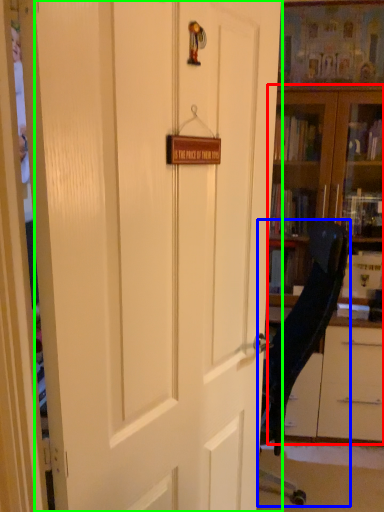
Question: Which object is the closest to the bookcase (highlighted by a red box)? Choose among these: chair (highlighted by a blue box) or door (highlighted by a green box).

Choices:
 (A) chair
 (B) door

Answer: (A)